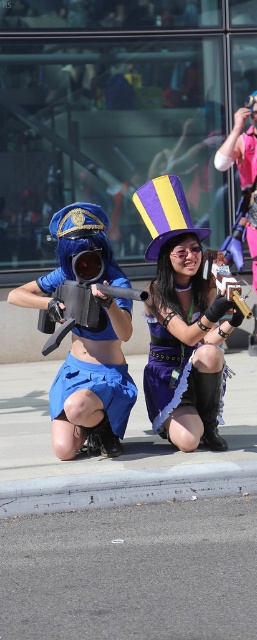
You are a photographer at a cosplay event. You need to capture a closeup shot of the matte blue uniform at left and the matte black gun at center. Given that your camera has a maximum focus range of 8 inches, will you be able to focus on both subjects simultaneously?

The distance between the matte blue uniform at left and the matte black gun at center is 8.63 inches. Since the maximum focus range is 8 inches, the camera cannot focus on both subjects simultaneously as the distance exceeds the limit.

Based on the provided scene description, what does the point at coordinates (x=94, y=385) represent?

The point at coordinates (x=94, y=385) indicates the location of the matte blue uniform at left.

You are a photographer at a cosplay event. You need to position a light source to ensure both the matte blue uniform at left and the black leather boot at lower center are well lit. Based on their positions, which object should be closer to the light source to avoid shadows?

The matte blue uniform at left is above the black leather boot at lower center, so positioning the light source closer to the matte blue uniform at left would help illuminate both objects effectively without casting harsh shadows on the lower boot.